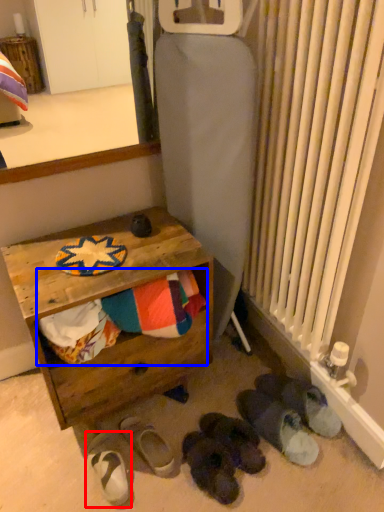
Question: Which point is further to the camera, footwear (highlighted by a red box) or laundry (highlighted by a blue box)?

Choices:
 (A) footwear
 (B) laundry

Answer: (A)